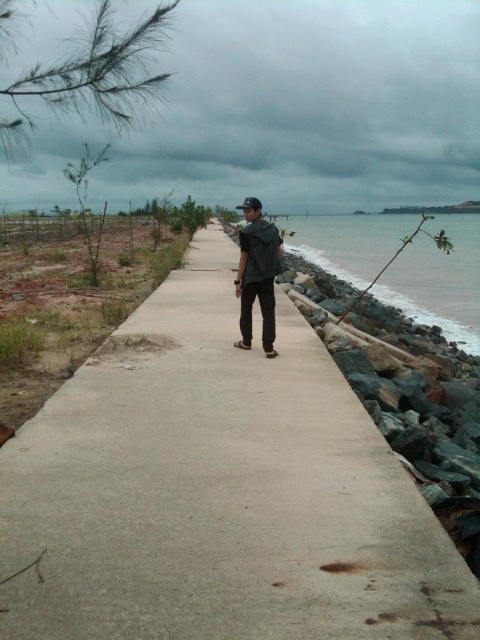
Based on the photo, can you confirm if concrete at center is shorter than green stone water at right?

Yes.

Is point (300, 557) more distant than point (431, 288)?

No, it is not.

Identify the location of concrete at center. (217, 492).

Does concrete at center appear on the left side of dark gray fabric backpack at center?

Yes, concrete at center is to the left of dark gray fabric backpack at center.

Between concrete at center and dark gray fabric backpack at center, which one is positioned lower?

Positioned lower is concrete at center.

Which is behind, point (156, 316) or point (244, 337)?

The point (156, 316) is more distant.

What are the coordinates of `concrete at center` in the screenshot? It's located at click(217, 492).

From the picture: Measure the distance between dark gray cloudy sky at upper center and dark gray fabric backpack at center.

A distance of 161.46 feet exists between dark gray cloudy sky at upper center and dark gray fabric backpack at center.

Between point (384, 147) and point (252, 273), which one is positioned in front?

Point (252, 273) is in front.

Where is `dark gray cloudy sky at upper center`? The image size is (480, 640). dark gray cloudy sky at upper center is located at coordinates (289, 109).

Where is `dark gray cloudy sky at upper center`? dark gray cloudy sky at upper center is located at coordinates (289, 109).